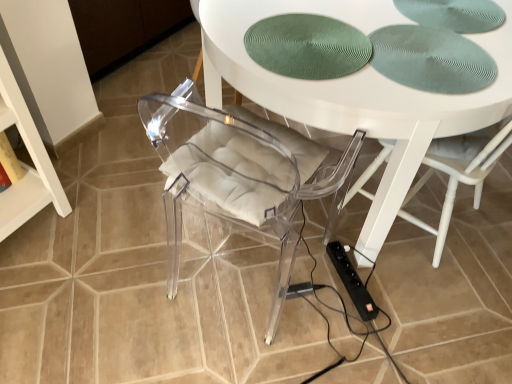
The height and width of the screenshot is (384, 512). In order to click on vacant space that is to the left of black plastic extension cord at lower right in this screenshot , I will do `click(313, 278)`.